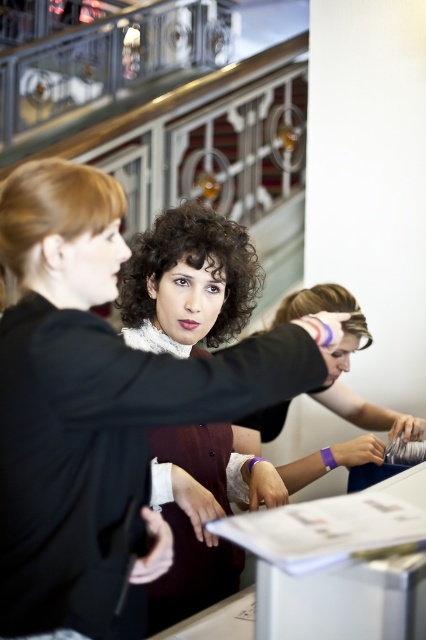
Question: Is matte black jacket at center to the left of curly brown hair at center from the viewer's perspective?

Choices:
 (A) no
 (B) yes

Answer: (B)

Question: Which point is farther to the camera?

Choices:
 (A) (239, 298)
 (B) (28, 477)

Answer: (A)

Question: Which of the following is the closest to the observer?

Choices:
 (A) (242, 346)
 (B) (345, 356)
 (C) (160, 298)
 (D) (19, 228)

Answer: (A)

Question: Is purple fabric wristband at center positioned before blonde hair at left?

Choices:
 (A) no
 (B) yes

Answer: (A)

Question: Can you confirm if matte black hair at center is smaller than curly brown hair at center?

Choices:
 (A) no
 (B) yes

Answer: (A)

Question: Among these points, which one is farthest from the camera?

Choices:
 (A) (356, 339)
 (B) (89, 356)
 (C) (249, 246)
 (D) (129, 333)

Answer: (A)